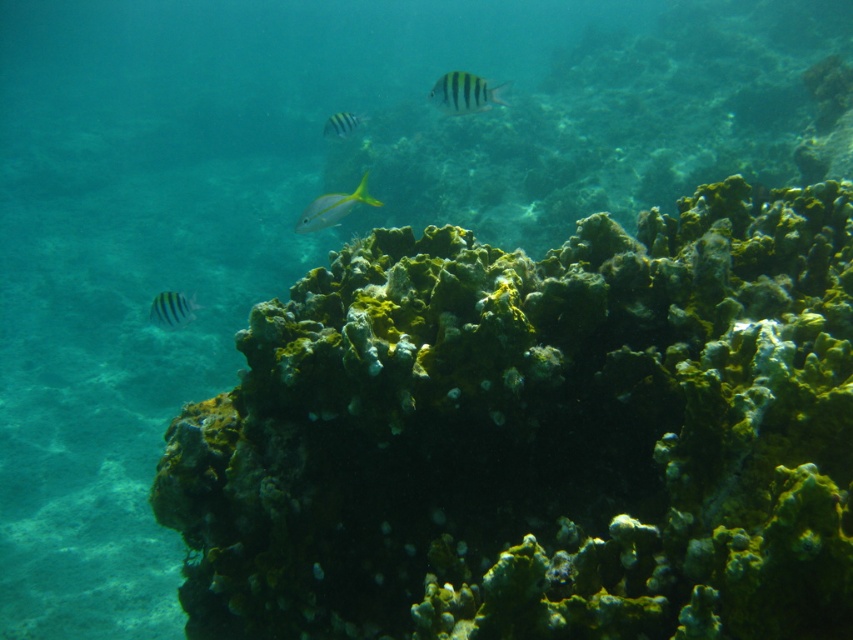
Does yellow matte fish at center have a greater width compared to striped yellow and black fish at upper center?

Correct, the width of yellow matte fish at center exceeds that of striped yellow and black fish at upper center.

Can you confirm if yellow matte fish at center is smaller than striped yellow and black fish at upper center?

No.

Identify the location of yellow matte fish at center. The width and height of the screenshot is (853, 640). (334, 208).

I want to click on yellow matte fish at center, so click(334, 208).

Is point (450, 100) closer to camera compared to point (334, 131)?

Yes.

Who is higher up, striped matte fish at upper center or striped yellow and black fish at upper center?

Positioned higher is striped yellow and black fish at upper center.

Where is `striped matte fish at upper center`? Image resolution: width=853 pixels, height=640 pixels. striped matte fish at upper center is located at coordinates (463, 93).

In order to click on striped matte fish at upper center in this screenshot , I will do `click(463, 93)`.

Does striped matte fish at upper center appear under yellow matte fish at center?

Actually, striped matte fish at upper center is above yellow matte fish at center.

From the picture: Is striped matte fish at upper center positioned behind yellow matte fish at center?

Yes, it is behind yellow matte fish at center.

Who is more distant from viewer, (451, 113) or (347, 209)?

Point (451, 113)

Locate an element on the screen. The width and height of the screenshot is (853, 640). striped matte fish at upper center is located at coordinates (x=463, y=93).